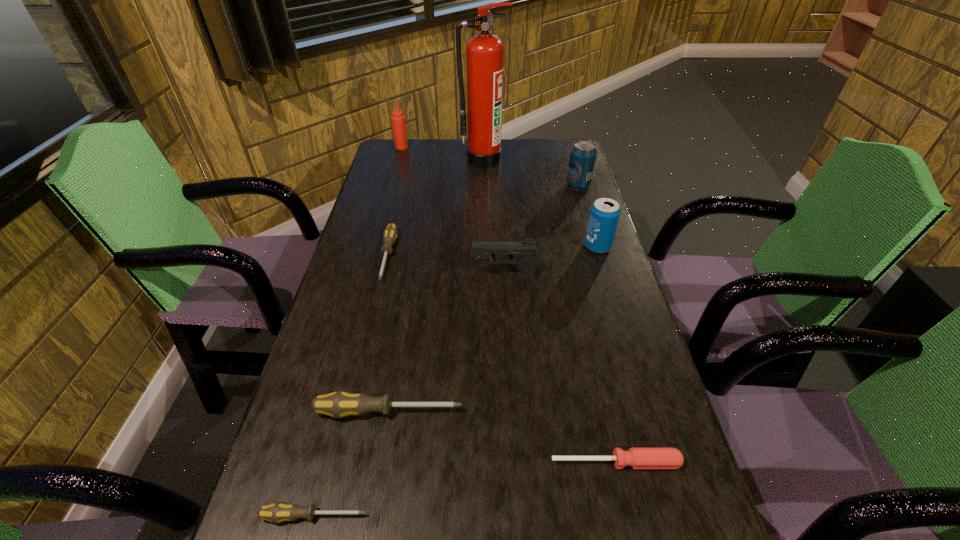
Identify the location of the second nearest object. The width and height of the screenshot is (960, 540). (638, 458).

The height and width of the screenshot is (540, 960). Find the location of `the rightmost screwdriver`. the rightmost screwdriver is located at coordinates (638, 458).

Locate an element on the screen. the smallest gray screwdriver is located at coordinates [277, 512].

You are a GUI agent. You are given a task and a screenshot of the screen. Output one action in this format:
    pyautogui.click(x=<x>, y=<y>)
    Task: Click on the nearest gray screwdriver
    Image resolution: width=960 pixels, height=540 pixels.
    Given the screenshot: What is the action you would take?
    pyautogui.click(x=277, y=512)

Identify the location of vacant area situated 0.090m with the nozzle pointing from the back of the fire extinguisher. This screenshot has height=540, width=960. (483, 181).

The height and width of the screenshot is (540, 960). Find the location of `vacant space positioned 0.080m on the front of the farthest object`. vacant space positioned 0.080m on the front of the farthest object is located at coordinates (398, 160).

Where is `vacant area situated on the front of the seventh nearest object`? The width and height of the screenshot is (960, 540). vacant area situated on the front of the seventh nearest object is located at coordinates (585, 205).

The image size is (960, 540). I want to click on vacant space located on the left of the blue soda can, so click(x=540, y=247).

I want to click on free space located at the barrel of the pistol, so click(390, 276).

Find the location of a particular element. vacant position located 0.090m at the barrel of the pistol is located at coordinates (438, 276).